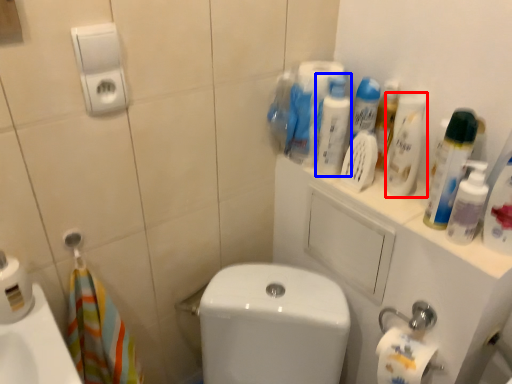
Question: Which of the following is the farthest to the observer, cleaning product (highlighted by a red box) or cleaning product (highlighted by a blue box)?

Choices:
 (A) cleaning product
 (B) cleaning product

Answer: (B)